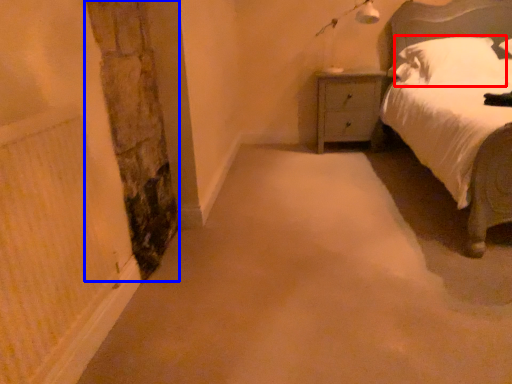
Question: Among these objects, which one is nearest to the camera, pillow (highlighted by a red box) or pillar (highlighted by a blue box)?

Choices:
 (A) pillow
 (B) pillar

Answer: (B)